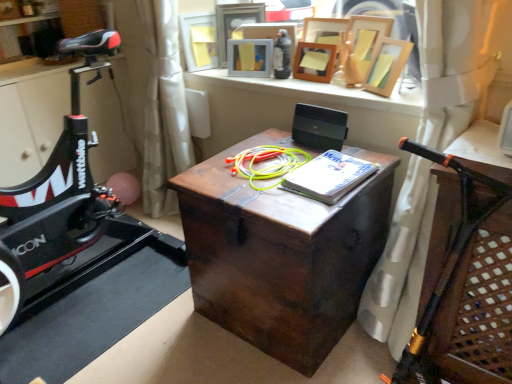
The image size is (512, 384). I want to click on dark wood trunk at center, so click(281, 254).

The image size is (512, 384). What do you see at coordinates (314, 62) in the screenshot?
I see `wooden picture frame at upper center, marked as the 3th picture frame in a right-to-left arrangement` at bounding box center [314, 62].

Identify the location of wooden picture frame at upper center, which appears as the sixth picture frame when viewed from the left. This screenshot has height=384, width=512. (386, 65).

Image resolution: width=512 pixels, height=384 pixels. Describe the element at coordinates (234, 23) in the screenshot. I see `wooden picture frame at upper center, which is counted as the 5th picture frame, starting from the right` at that location.

At what (x,y) coordinates should I click in order to perform the action: click on wooden picture frame at upper center, placed as the 6th picture frame when sorted from right to left. Please return your answer as a coordinate pair (x, y). The width and height of the screenshot is (512, 384). Looking at the image, I should click on [199, 40].

Identify the location of wooden table at right. (478, 310).

Image resolution: width=512 pixels, height=384 pixels. Describe the element at coordinates (478, 310) in the screenshot. I see `wooden table at right` at that location.

Measure the distance between point (229,42) and camera.

The distance of point (229,42) from camera is 2.14 meters.

Identify the location of dark wood trunk at center. (281, 254).

Consider the image. Which point is more distant from viewer, (223, 61) or (214, 26)?

Point (223, 61)

Between wooden picture frame at upper center, which is counted as the 5th picture frame, starting from the right, and wooden picture frame at upper center, placed as the 6th picture frame when sorted from right to left, which one has larger size?

wooden picture frame at upper center, which is counted as the 5th picture frame, starting from the right, is bigger.

Considering the positions of objects wooden picture frame at upper center, which is counted as the 5th picture frame, starting from the right, and wooden picture frame at upper center, which is the first picture frame in left-to-right order, in the image provided, who is behind, wooden picture frame at upper center, which is counted as the 5th picture frame, starting from the right, or wooden picture frame at upper center, which is the first picture frame in left-to-right order,?

wooden picture frame at upper center, which is counted as the 5th picture frame, starting from the right.

Which is correct: wooden picture frame at upper center, marked as the 3th picture frame in a right-to-left arrangement, is inside wooden picture frame at upper center, which appears as the first picture frame when viewed from the right, or outside of it?

The correct answer is: outside.

Is wooden picture frame at upper center, marked as the 3th picture frame in a right-to-left arrangement, oriented away from wooden picture frame at upper center, which appears as the sixth picture frame when viewed from the left?

No, wooden picture frame at upper center, marked as the 3th picture frame in a right-to-left arrangement,'s orientation is not away from wooden picture frame at upper center, which appears as the sixth picture frame when viewed from the left.

From a real-world perspective, is wooden picture frame at upper center, marked as the fourth picture frame in a left-to-right arrangement, physically below wooden picture frame at upper center, which appears as the sixth picture frame when viewed from the left?

Yes, from a real-world perspective, wooden picture frame at upper center, marked as the fourth picture frame in a left-to-right arrangement, is beneath wooden picture frame at upper center, which appears as the sixth picture frame when viewed from the left.

Find the location of a particular element. Image resolution: width=512 pixels, height=384 pixels. picture frame located below the wooden picture frame at upper center, marked as the fourth picture frame in a left-to-right arrangement (from the image's perspective) is located at coordinates (386, 65).

Is wooden picture frame at upper center, marked as the fourth picture frame in a left-to-right arrangement, surrounding matte plastic picture frame at upper center, the 3th picture frame from the left?

No.

Is point (315, 51) closer to viewer compared to point (258, 45)?

Yes, it is in front of point (258, 45).

Are wooden picture frame at upper center, marked as the 3th picture frame in a right-to-left arrangement, and matte plastic picture frame at upper center, the 4th picture frame positioned from the right, far apart?

No, wooden picture frame at upper center, marked as the 3th picture frame in a right-to-left arrangement, is not far away from matte plastic picture frame at upper center, the 4th picture frame positioned from the right.

Measure the distance from wooden picture frame at upper center, marked as the 3th picture frame in a right-to-left arrangement, to matte plastic picture frame at upper center, the 3th picture frame from the left.

The distance of wooden picture frame at upper center, marked as the 3th picture frame in a right-to-left arrangement, from matte plastic picture frame at upper center, the 3th picture frame from the left, is 8.68 inches.

From a real-world perspective, between wooden picture frame at upper center, which ranks as the second picture frame in left-to-right order, and wooden picture frame at upper center, the 5th picture frame when ordered from left to right, who is vertically lower?

wooden picture frame at upper center, the 5th picture frame when ordered from left to right, from a real-world perspective.

Is wooden picture frame at upper center, which ranks as the second picture frame in left-to-right order, behind wooden picture frame at upper center, which appears as the 2th picture frame when viewed from the right?

Yes, the depth of wooden picture frame at upper center, which ranks as the second picture frame in left-to-right order, is greater than that of wooden picture frame at upper center, which appears as the 2th picture frame when viewed from the right.

Which of these two, wooden picture frame at upper center, which is counted as the 5th picture frame, starting from the right, or wooden picture frame at upper center, the 5th picture frame when ordered from left to right, is bigger?

wooden picture frame at upper center, the 5th picture frame when ordered from left to right.

Is wooden picture frame at upper center, which is counted as the 5th picture frame, starting from the right, far away from wooden picture frame at upper center, which appears as the 2th picture frame when viewed from the right?

No.

The height and width of the screenshot is (384, 512). What are the coordinates of `the 3rd picture frame behind the wooden picture frame at upper center, which appears as the sixth picture frame when viewed from the left` in the screenshot? It's located at (250, 57).

From a real-world perspective, is wooden picture frame at upper center, which appears as the first picture frame when viewed from the right, above or below matte plastic picture frame at upper center, the 4th picture frame positioned from the right?

Clearly, from a real-world perspective, wooden picture frame at upper center, which appears as the first picture frame when viewed from the right, is above matte plastic picture frame at upper center, the 4th picture frame positioned from the right.

Can you confirm if wooden picture frame at upper center, which appears as the sixth picture frame when viewed from the left, is taller than matte plastic picture frame at upper center, the 3th picture frame from the left?

Indeed, wooden picture frame at upper center, which appears as the sixth picture frame when viewed from the left, has a greater height compared to matte plastic picture frame at upper center, the 3th picture frame from the left.

Which point is more distant from viewer, (247, 65) or (308, 57)?

Point (247, 65)

Does matte plastic picture frame at upper center, the 3th picture frame from the left, touch wooden picture frame at upper center, marked as the fourth picture frame in a left-to-right arrangement?

No.

Starting from the matte plastic picture frame at upper center, the 4th picture frame positioned from the right, which picture frame is the 1st one in front? Please provide its 2D coordinates.

[(314, 62)]

Could you tell me if matte plastic picture frame at upper center, the 3th picture frame from the left, is facing wooden picture frame at upper center, marked as the fourth picture frame in a left-to-right arrangement?

No, matte plastic picture frame at upper center, the 3th picture frame from the left, is not turned towards wooden picture frame at upper center, marked as the fourth picture frame in a left-to-right arrangement.

In the scene shown: Does wooden picture frame at upper center, marked as the 3th picture frame in a right-to-left arrangement, appear on the right side of wooden picture frame at upper center, the 5th picture frame when ordered from left to right?

In fact, wooden picture frame at upper center, marked as the 3th picture frame in a right-to-left arrangement, is to the left of wooden picture frame at upper center, the 5th picture frame when ordered from left to right.

Would you say wooden picture frame at upper center, marked as the fourth picture frame in a left-to-right arrangement, is a long distance from wooden picture frame at upper center, the 5th picture frame when ordered from left to right?

Actually, wooden picture frame at upper center, marked as the fourth picture frame in a left-to-right arrangement, and wooden picture frame at upper center, the 5th picture frame when ordered from left to right, are a little close together.

Between wooden picture frame at upper center, marked as the 3th picture frame in a right-to-left arrangement, and wooden picture frame at upper center, the 5th picture frame when ordered from left to right, which one has less height?

wooden picture frame at upper center, marked as the 3th picture frame in a right-to-left arrangement.

Looking at this image, looking at the image, does wooden picture frame at upper center, marked as the fourth picture frame in a left-to-right arrangement, seem bigger or smaller compared to wooden picture frame at upper center, which appears as the 2th picture frame when viewed from the right?

wooden picture frame at upper center, marked as the fourth picture frame in a left-to-right arrangement, is smaller than wooden picture frame at upper center, which appears as the 2th picture frame when viewed from the right.

Where is `picture frame located behind the wooden picture frame at upper center, which is the first picture frame in left-to-right order`? picture frame located behind the wooden picture frame at upper center, which is the first picture frame in left-to-right order is located at coordinates pos(234,23).

Identify the location of picture frame that is the 1st one when counting upward from the wooden picture frame at upper center, which appears as the sixth picture frame when viewed from the left (from the image's perspective). (314, 62).

Based on their spatial positions, is wooden table at right or wooden picture frame at upper center, marked as the 3th picture frame in a right-to-left arrangement, closer to wooden picture frame at upper center, which ranks as the second picture frame in left-to-right order?

wooden picture frame at upper center, marked as the 3th picture frame in a right-to-left arrangement, is positioned closer to the anchor wooden picture frame at upper center, which ranks as the second picture frame in left-to-right order.

Estimate the real-world distances between objects in this image. Which object is closer to wooden table at right, wooden picture frame at upper center, marked as the fourth picture frame in a left-to-right arrangement, or wooden picture frame at upper center, placed as the 6th picture frame when sorted from right to left?

wooden picture frame at upper center, marked as the fourth picture frame in a left-to-right arrangement, is closer to wooden table at right.

Looking at the image, which one is located closer to dark wood trunk at center, wooden table at right or wooden picture frame at upper center, marked as the fourth picture frame in a left-to-right arrangement?

wooden table at right.

When comparing their distances from wooden picture frame at upper center, which appears as the sixth picture frame when viewed from the left, does wooden picture frame at upper center, marked as the 3th picture frame in a right-to-left arrangement, or wooden picture frame at upper center, the 5th picture frame when ordered from left to right, seem closer?

wooden picture frame at upper center, the 5th picture frame when ordered from left to right, is closer to wooden picture frame at upper center, which appears as the sixth picture frame when viewed from the left.

Considering their positions, is wooden table at right positioned further to wooden picture frame at upper center, the 5th picture frame when ordered from left to right, than wooden picture frame at upper center, marked as the fourth picture frame in a left-to-right arrangement?

Based on the image, wooden table at right appears to be further to wooden picture frame at upper center, the 5th picture frame when ordered from left to right.

Looking at the image, which one is located further to wooden picture frame at upper center, marked as the 3th picture frame in a right-to-left arrangement, wooden picture frame at upper center, placed as the 6th picture frame when sorted from right to left, or wooden picture frame at upper center, which appears as the first picture frame when viewed from the right?

wooden picture frame at upper center, placed as the 6th picture frame when sorted from right to left, lies further to wooden picture frame at upper center, marked as the 3th picture frame in a right-to-left arrangement, than the other object.

Based on their spatial positions, is matte plastic picture frame at upper center, the 3th picture frame from the left, or wooden picture frame at upper center, which appears as the first picture frame when viewed from the right, further from wooden picture frame at upper center, which ranks as the second picture frame in left-to-right order?

Among the two, wooden picture frame at upper center, which appears as the first picture frame when viewed from the right, is located further to wooden picture frame at upper center, which ranks as the second picture frame in left-to-right order.

From the image, which object appears to be farther from wooden picture frame at upper center, which ranks as the second picture frame in left-to-right order, wooden picture frame at upper center, the 5th picture frame when ordered from left to right, or wooden table at right?

The object further to wooden picture frame at upper center, which ranks as the second picture frame in left-to-right order, is wooden table at right.

The image size is (512, 384). I want to click on desk between wooden picture frame at upper center, the 5th picture frame when ordered from left to right, and wooden table at right in the up-down direction, so click(x=281, y=254).

Locate an element on the screen. desk between wooden table at right and matte plastic picture frame at upper center, the 4th picture frame positioned from the right, from front to back is located at coordinates (281, 254).

What are the coordinates of `desk between wooden picture frame at upper center, which appears as the first picture frame when viewed from the right, and wooden table at right from top to bottom` in the screenshot? It's located at (281, 254).

I want to click on desk located between wooden table at right and wooden picture frame at upper center, which is the first picture frame in left-to-right order, in the depth direction, so click(281, 254).